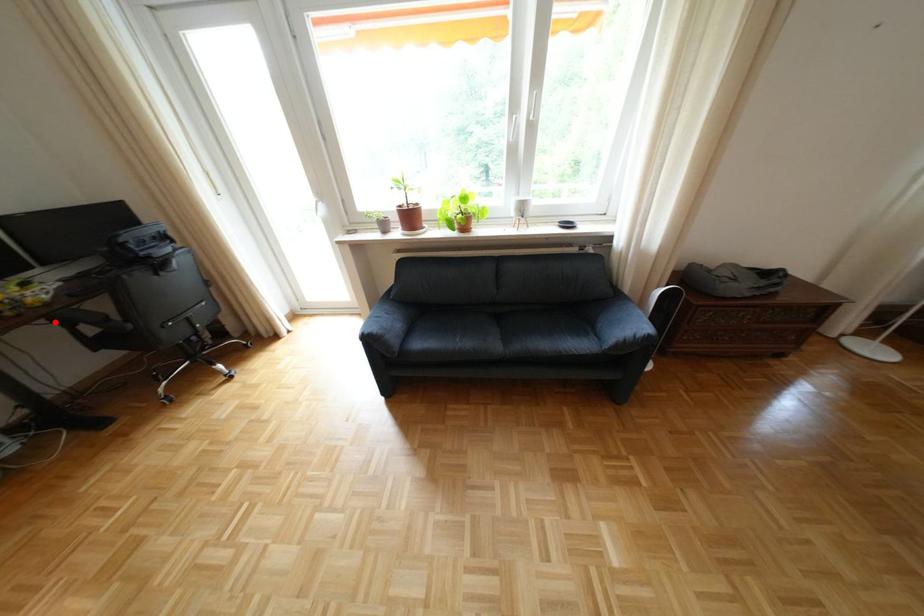
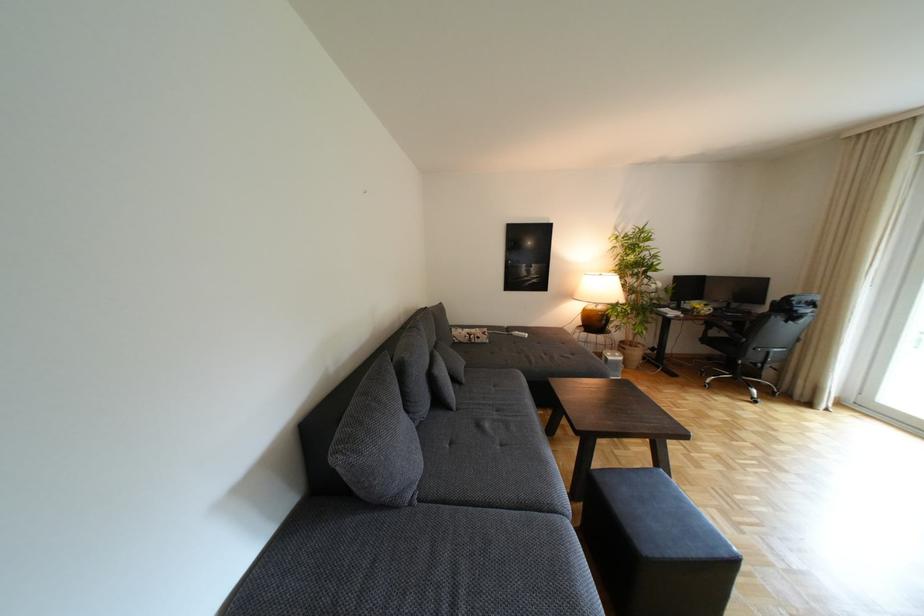
Question: I am providing you with two images of the same scene from different viewpoints. Image1 has a red point marked. In image2, the corresponding 3D location appears at what relative position? Reply with the corresponding letter.

Choices:
 (A) Closer
 (B) Farther

Answer: (A)